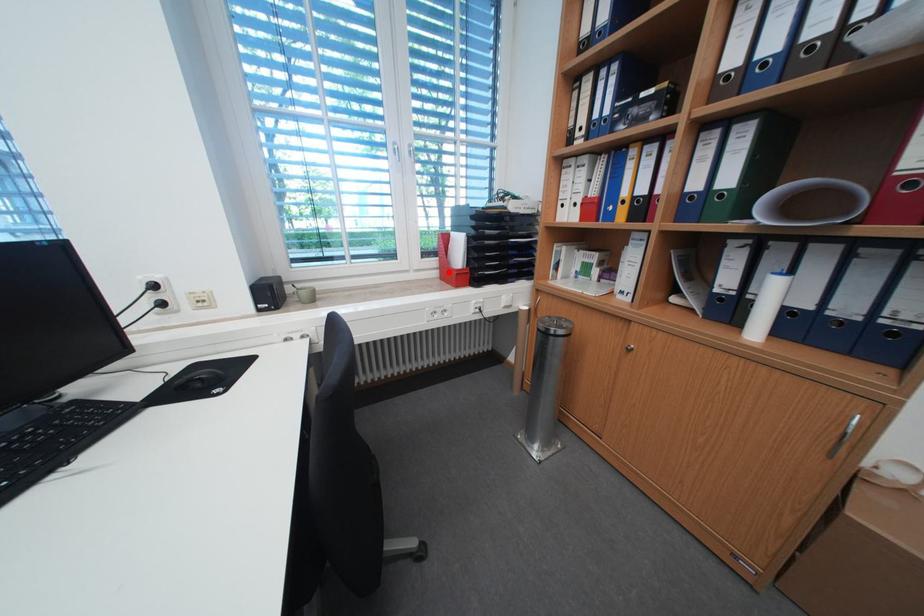
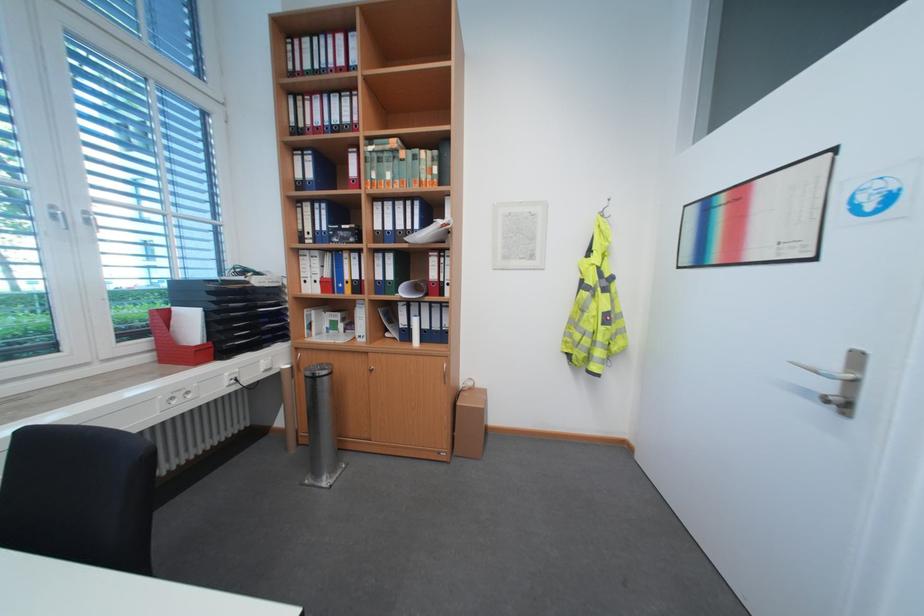
Locate, in the second image, the point that corresponds to the highlighted location in the first image.

(164, 355)